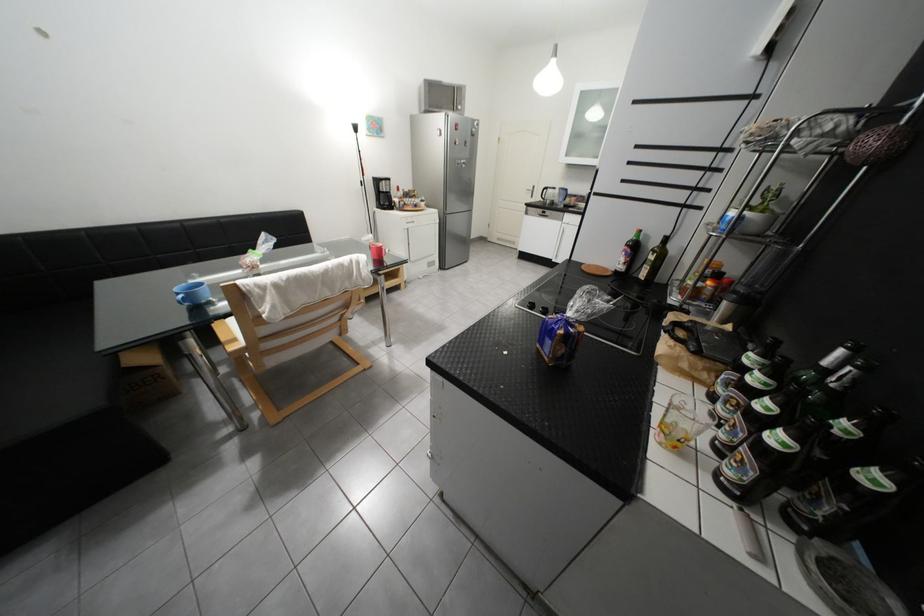
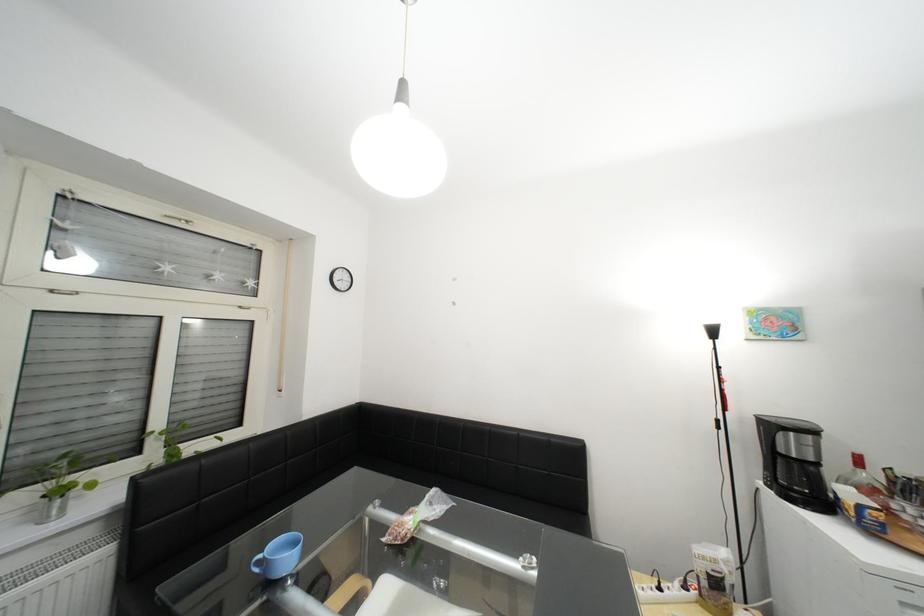
Find the pixel in the second image that matches the point at 388,182 in the first image.

(782, 428)